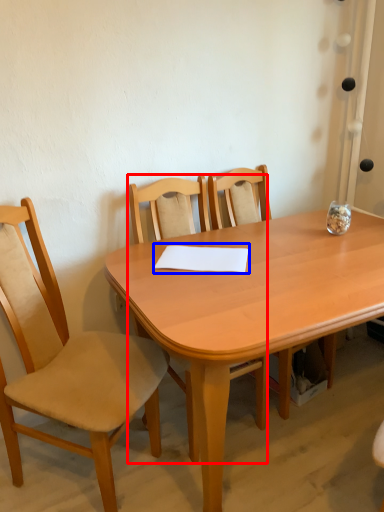
Question: Which object appears farthest to the camera in this image, chair (highlighted by a red box) or notepad (highlighted by a blue box)?

Choices:
 (A) chair
 (B) notepad

Answer: (B)